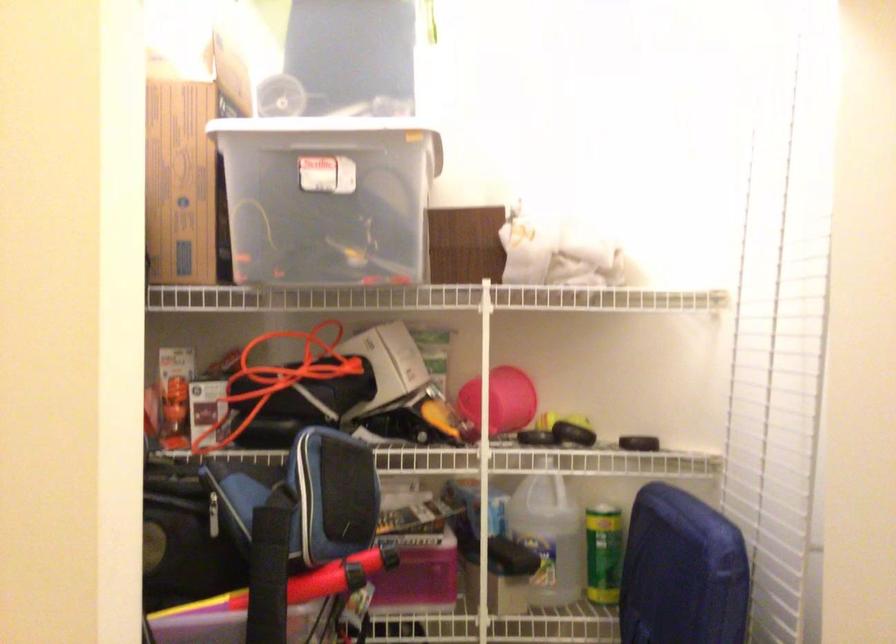
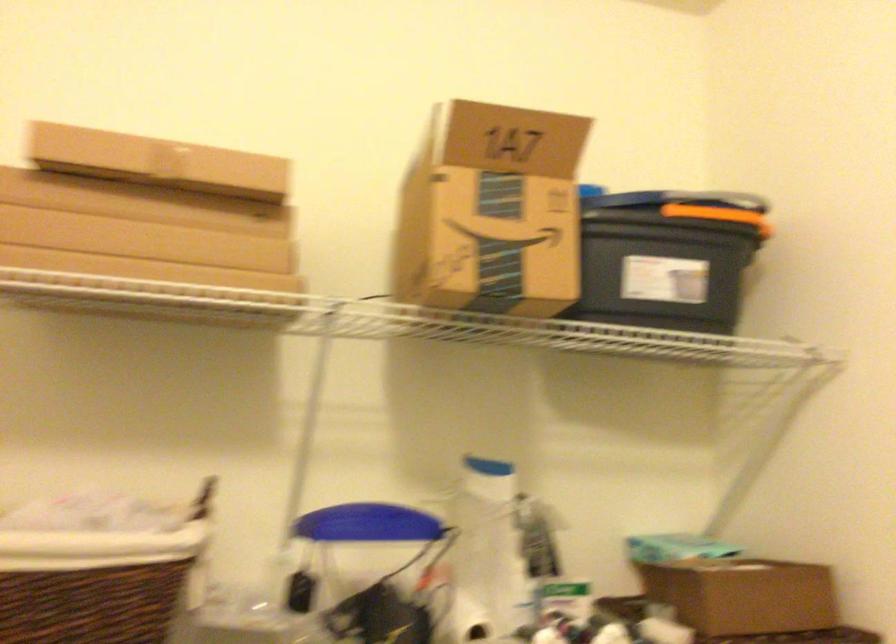
Question: The camera is either moving clockwise (left) or counter-clockwise (right) around the object. The first image is from the beginning of the video and the second image is from the end. Is the camera moving left or right when shooting the video?

Choices:
 (A) Left
 (B) Right

Answer: (B)